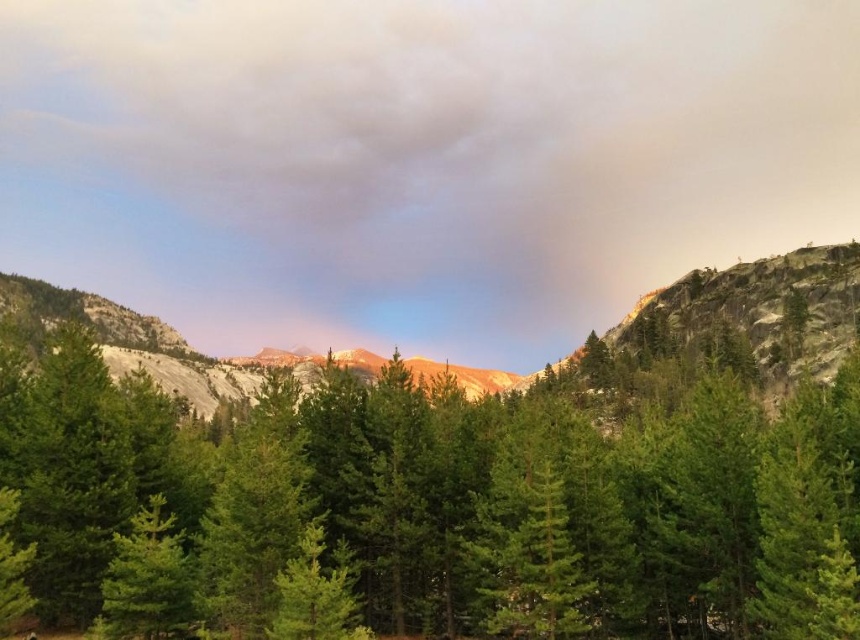
Question: Which object appears farthest from the camera in this image?

Choices:
 (A) green matte tree at center
 (B) smokey gray cloud at upper center

Answer: (B)

Question: Can you confirm if smokey gray cloud at upper center is wider than green matte tree at center?

Choices:
 (A) no
 (B) yes

Answer: (B)

Question: Does green matte tree at center have a greater width compared to rugged granite mountain at center?

Choices:
 (A) no
 (B) yes

Answer: (A)

Question: Can you confirm if green matte tree at center is wider than rugged granite mountain at center?

Choices:
 (A) yes
 (B) no

Answer: (B)

Question: Among these points, which one is farthest from the camera?

Choices:
 (A) (545, 228)
 (B) (819, 362)
 (C) (90, 614)

Answer: (A)

Question: Which point appears closest to the camera in this image?

Choices:
 (A) (91, 296)
 (B) (189, 262)
 (C) (16, 451)

Answer: (C)